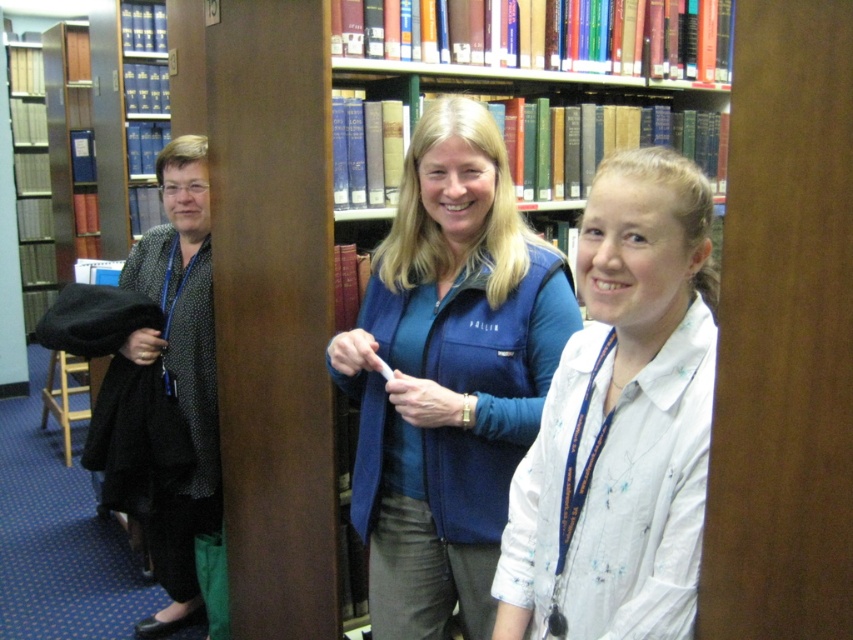
Is blue fleece vest at center positioned behind black dotted blouse at left?

Result: No.

Does point (489, 172) come closer to viewer compared to point (206, 397)?

That is True.

I want to click on blue fleece vest at center, so click(x=448, y=374).

Between blue fleece vest at center and white cotton shirt at center, which one is positioned lower?

Positioned lower is white cotton shirt at center.

Is blue fleece vest at center wider than white cotton shirt at center?

Indeed, blue fleece vest at center has a greater width compared to white cotton shirt at center.

Who is more forward, (399, 500) or (503, 595)?

Positioned in front is point (503, 595).

The image size is (853, 640). I want to click on blue fleece vest at center, so click(x=448, y=374).

Between point (682, 259) and point (183, 545), which one is positioned in front?

Point (682, 259)

Which is more to the left, wooden bookcase at center or black dotted blouse at left?

black dotted blouse at left is more to the left.

Between point (689, 529) and point (202, 170), which one is positioned in front?

Point (689, 529) is more forward.

You are a GUI agent. You are given a task and a screenshot of the screen. Output one action in this format:
    pyautogui.click(x=<x>, y=<y>)
    Task: Click on the wooden bookcase at center
    The width and height of the screenshot is (853, 640).
    Given the screenshot: What is the action you would take?
    pyautogui.click(x=624, y=429)